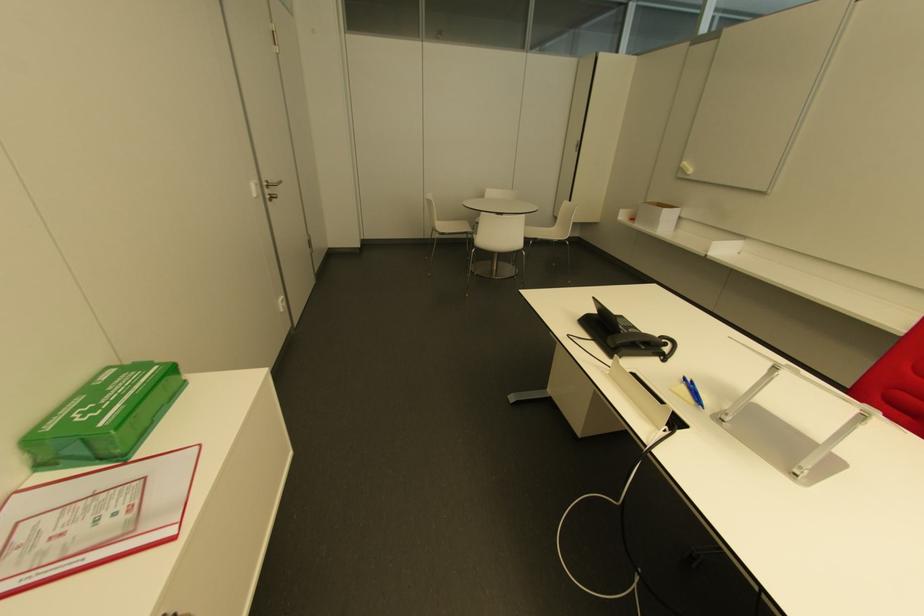
Image resolution: width=924 pixels, height=616 pixels. What are the coordinates of `green first aid box` in the screenshot? It's located at point(103,416).